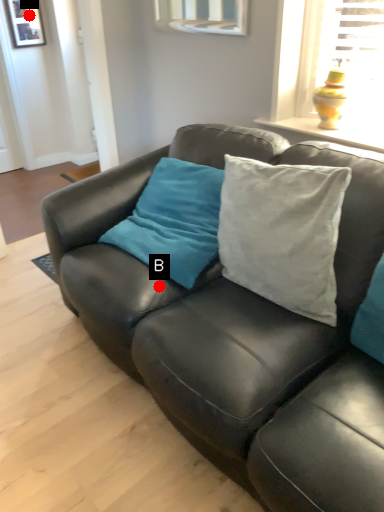
Question: Two points are circled on the image, labeled by A and B beside each circle. Which point appears farthest from the camera in this image?

Choices:
 (A) A is further
 (B) B is further

Answer: (A)